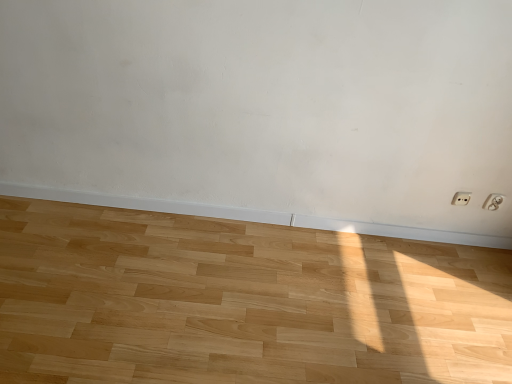
Question: Is point (482, 205) closer or farther from the camera than point (458, 203)?

Choices:
 (A) farther
 (B) closer

Answer: (A)

Question: Do you think white plastic electric outlet at lower right, the 2th electric outlet when ordered from left to right, is within white plastic electric outlet at lower right, which is the first electric outlet from left to right, or outside of it?

Choices:
 (A) inside
 (B) outside

Answer: (B)

Question: Based on their relative distances, which object is nearer to the white plastic electric outlet at lower right, which is counted as the 1th electric outlet, starting from the right?

Choices:
 (A) white plastic electric outlet at lower right, which is the first electric outlet from left to right
 (B) natural wood floor at center

Answer: (A)

Question: Estimate the real-world distances between objects in this image. Which object is closer to the natural wood floor at center?

Choices:
 (A) white plastic electric outlet at lower right, the 2th electric outlet when ordered from left to right
 (B) white plastic electric outlet at lower right, the second electric outlet viewed from the right

Answer: (B)